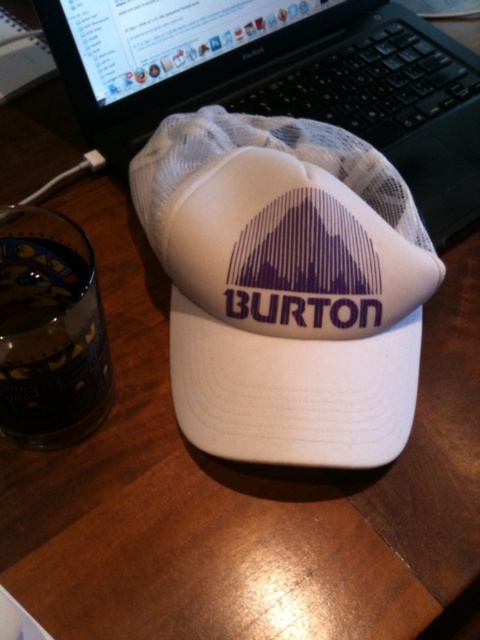
Question: Is white mesh hat at center positioned at the back of white mesh laptop at upper center?

Choices:
 (A) no
 (B) yes

Answer: (A)

Question: Which point is farther from the camera taking this photo?

Choices:
 (A) (388, 330)
 (B) (468, 161)

Answer: (B)

Question: Which object is closer to the camera taking this photo?

Choices:
 (A) white mesh laptop at upper center
 (B) white mesh hat at center

Answer: (B)

Question: Is white mesh hat at center behind white mesh laptop at upper center?

Choices:
 (A) no
 (B) yes

Answer: (A)

Question: Can you confirm if white mesh hat at center is positioned to the left of white mesh laptop at upper center?

Choices:
 (A) no
 (B) yes

Answer: (B)